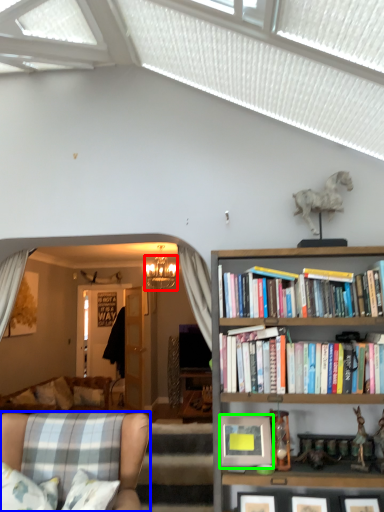
Question: Estimate the real-world distances between objects in this image. Which object is farther from lamp (highlighted by a red box), chair (highlighted by a blue box) or picture frame (highlighted by a green box)?

Choices:
 (A) chair
 (B) picture frame

Answer: (B)